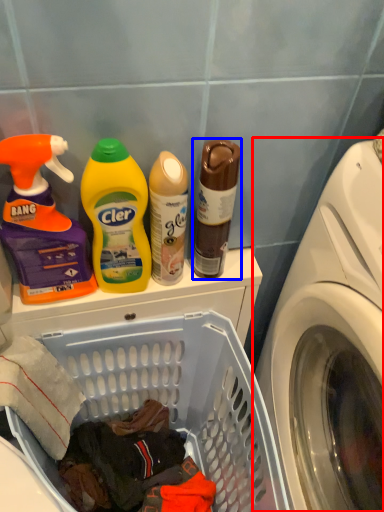
Question: Among these objects, which one is nearest to the camera, washing machine (highlighted by a red box) or bottle (highlighted by a blue box)?

Choices:
 (A) washing machine
 (B) bottle

Answer: (A)